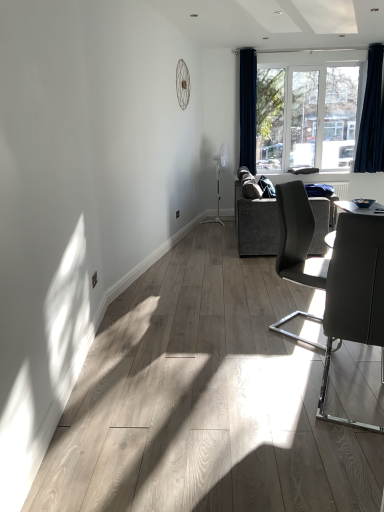
Question: Is clear glass window at upper center touching dark gray fabric couch at center-right?

Choices:
 (A) yes
 (B) no

Answer: (B)

Question: Is clear glass window at upper center located outside dark gray fabric couch at center-right?

Choices:
 (A) no
 (B) yes

Answer: (B)

Question: Does clear glass window at upper center have a larger size compared to dark gray fabric couch at center-right?

Choices:
 (A) no
 (B) yes

Answer: (A)

Question: Is clear glass window at upper center at the left side of dark gray fabric couch at center-right?

Choices:
 (A) yes
 (B) no

Answer: (B)

Question: Does clear glass window at upper center have a greater width compared to dark gray fabric couch at center-right?

Choices:
 (A) yes
 (B) no

Answer: (B)

Question: Based on their sizes in the image, would you say matte gray chair at center right, which appears as the second chair when viewed from the front, is bigger or smaller than dark gray fabric couch at center-right?

Choices:
 (A) big
 (B) small

Answer: (B)

Question: From their relative heights in the image, would you say matte gray chair at center right, which is the first chair from back to front, is taller or shorter than dark gray fabric couch at center-right?

Choices:
 (A) short
 (B) tall

Answer: (B)

Question: Considering the positions of matte gray chair at center right, which appears as the second chair when viewed from the front, and dark gray fabric couch at center-right in the image, is matte gray chair at center right, which appears as the second chair when viewed from the front, wider or thinner than dark gray fabric couch at center-right?

Choices:
 (A) wide
 (B) thin

Answer: (B)

Question: Is point tap(276, 202) closer or farther from the camera than point tap(248, 244)?

Choices:
 (A) closer
 (B) farther

Answer: (A)

Question: Would you say dark gray fabric couch at center-right is inside or outside matte gray chair at right, the second chair when ordered from back to front?

Choices:
 (A) inside
 (B) outside

Answer: (B)

Question: Is dark gray fabric couch at center-right in front of or behind matte gray chair at right, the second chair when ordered from back to front, in the image?

Choices:
 (A) behind
 (B) front

Answer: (A)

Question: Is dark gray fabric couch at center-right taller or shorter than matte gray chair at right, the second chair when ordered from back to front?

Choices:
 (A) tall
 (B) short

Answer: (B)

Question: Is dark gray fabric couch at center-right bigger or smaller than matte gray chair at right, the 1th chair in the front-to-back sequence?

Choices:
 (A) small
 (B) big

Answer: (B)

Question: Looking at their shapes, would you say matte gray chair at right, the second chair when ordered from back to front, is wider or thinner than clear glass window at upper center?

Choices:
 (A) thin
 (B) wide

Answer: (B)

Question: Would you say matte gray chair at right, the 1th chair in the front-to-back sequence, is to the left or to the right of clear glass window at upper center in the picture?

Choices:
 (A) left
 (B) right

Answer: (A)